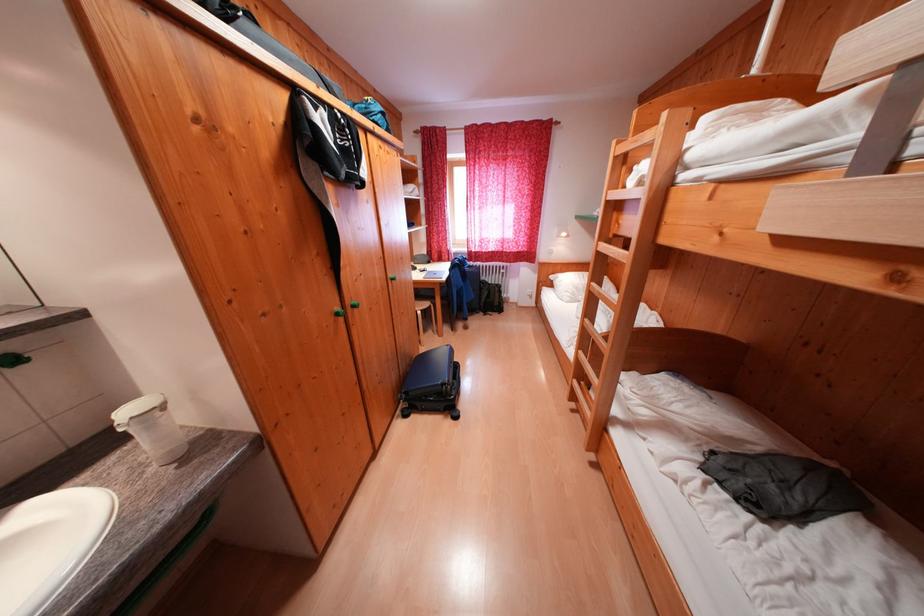
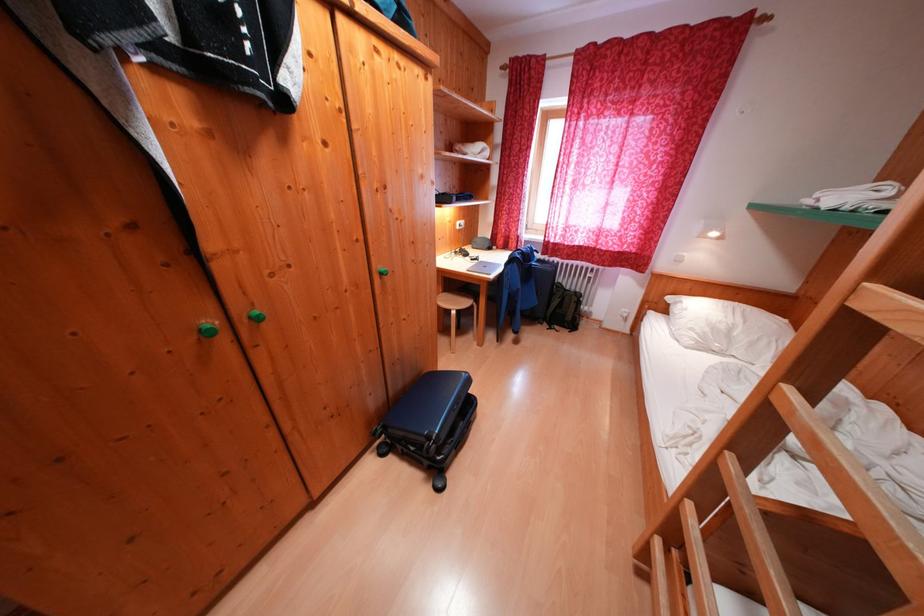
The images are taken continuously from a first-person perspective. In which direction are you moving?

The cameraman moved toward right, forward.